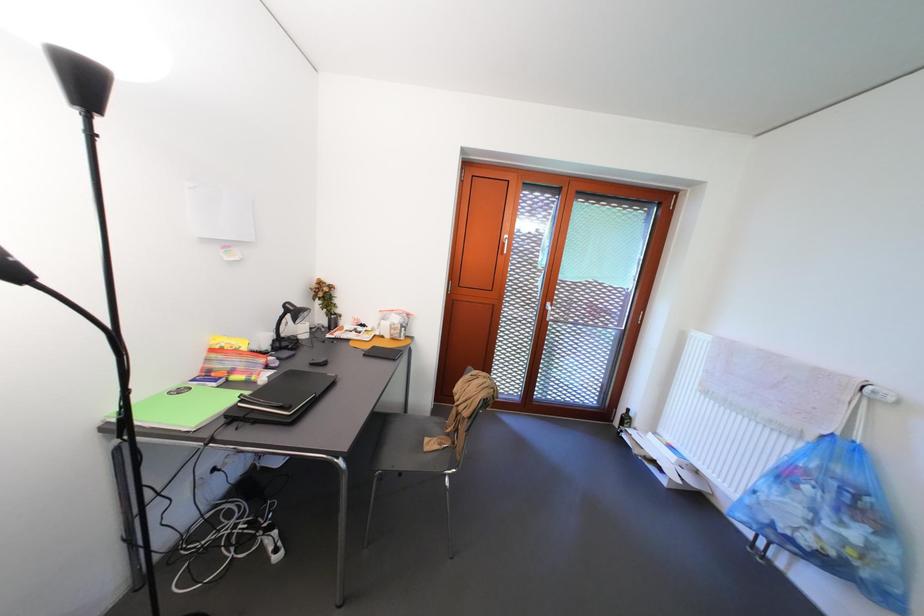
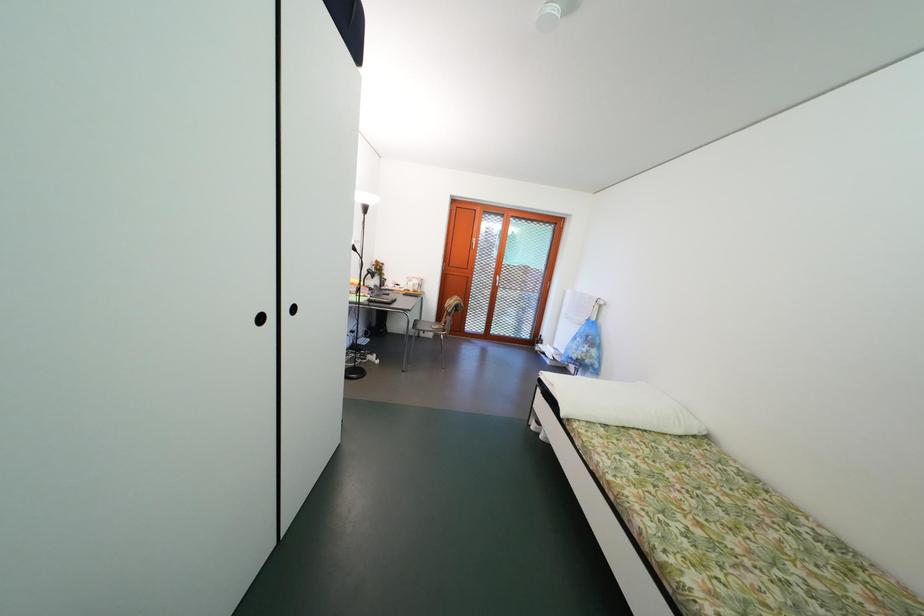
Question: The images are taken continuously from a first-person perspective. In which direction are you moving?

Choices:
 (A) Left
 (B) Right
 (C) Forward
 (D) Backward

Answer: (D)